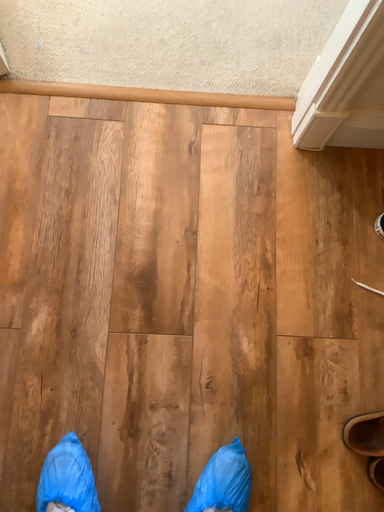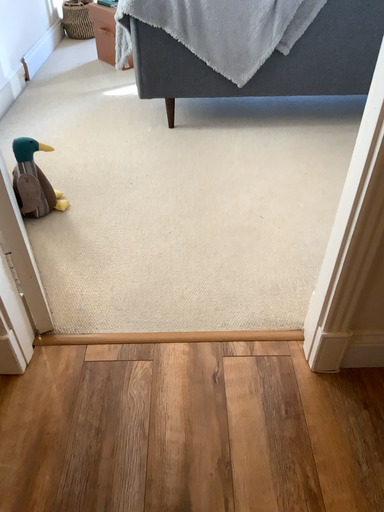
Question: Which way did the camera rotate in the video?

Choices:
 (A) rotated downward
 (B) rotated upward

Answer: (B)